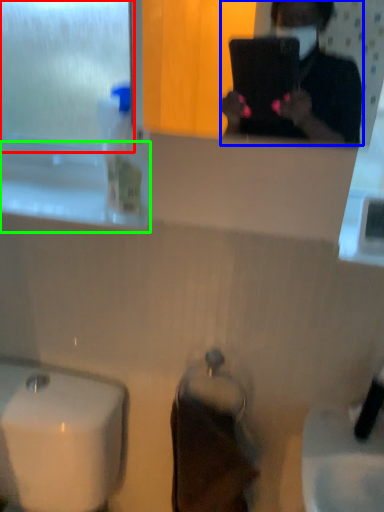
Question: Which object is positioned closest to window screen (highlighted by a red box)? Select from person (highlighted by a blue box) and window sill (highlighted by a green box).

Choices:
 (A) person
 (B) window sill

Answer: (B)